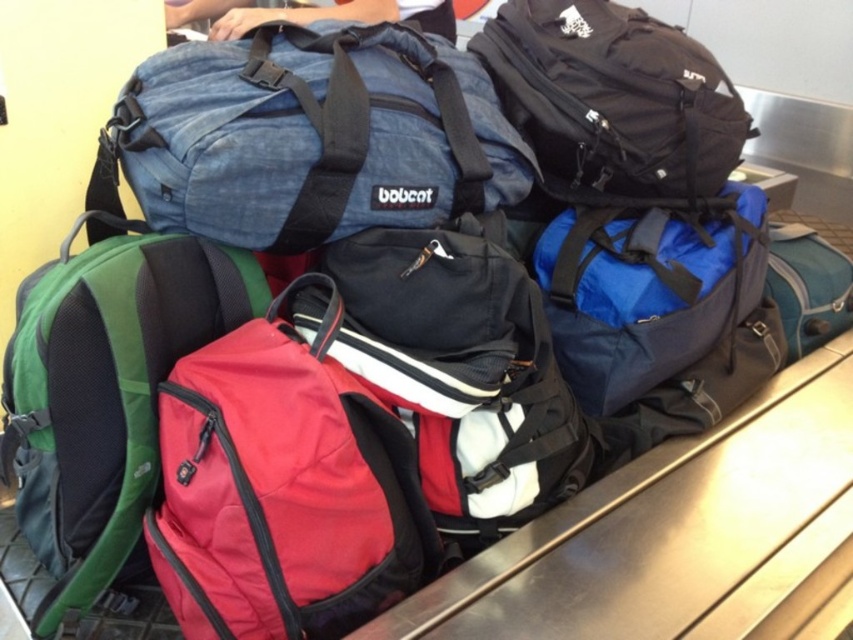
Question: From the image, what is the correct spatial relationship of denim fabric duffel at center in relation to matte green backpack at lower left?

Choices:
 (A) right
 (B) left

Answer: (A)

Question: Can you confirm if denim fabric duffel at center is smaller than matte green backpack at lower left?

Choices:
 (A) yes
 (B) no

Answer: (B)

Question: Which point is closer to the camera?

Choices:
 (A) (49, 349)
 (B) (289, 42)

Answer: (A)

Question: Which point is closer to the camera?

Choices:
 (A) pos(323,189)
 (B) pos(546,88)

Answer: (A)

Question: Does matte green backpack at lower left have a lesser width compared to black fabric backpack at upper right?

Choices:
 (A) no
 (B) yes

Answer: (B)

Question: Which is farther from the matte green backpack at lower left?

Choices:
 (A) denim fabric duffel at center
 (B) black fabric backpack at upper right

Answer: (B)